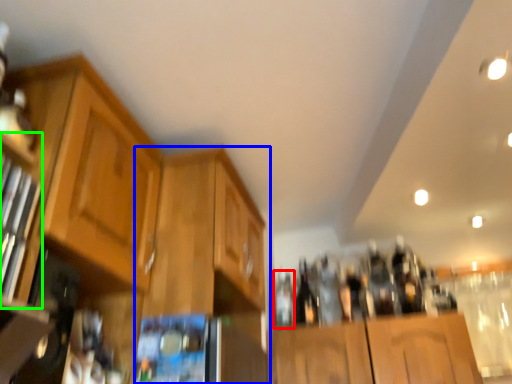
Question: Which object is positioned farthest from bottle (highlighted by a red box)? Select from cabinetry (highlighted by a blue box) and shelf (highlighted by a green box).

Choices:
 (A) cabinetry
 (B) shelf

Answer: (B)